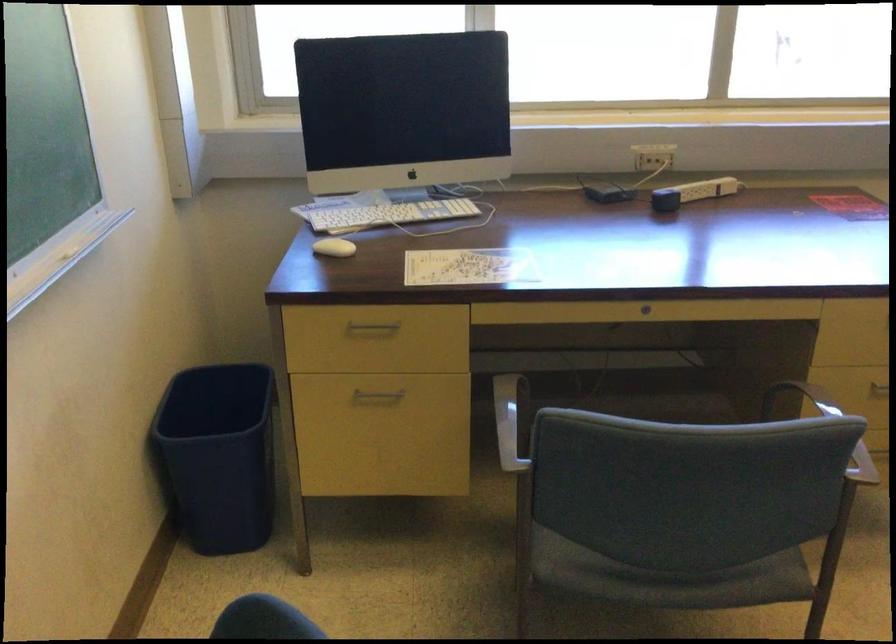
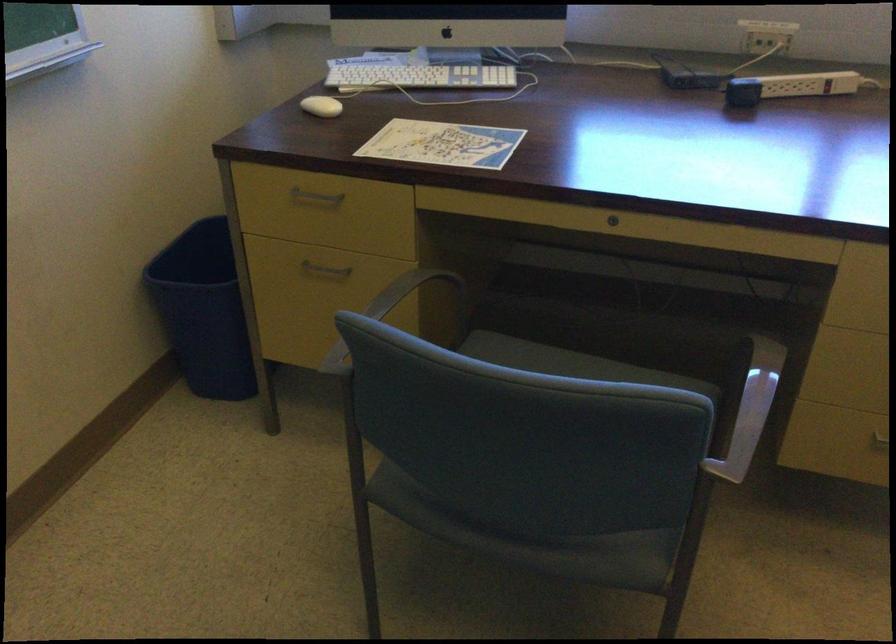
The point at (644, 307) is marked in the first image. Where is the corresponding point in the second image?

(613, 220)